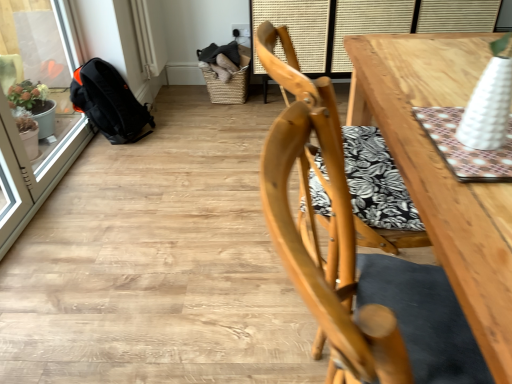
Question: From a real-world perspective, is black fabric backpack at left positioned above or below woven brown basket at upper center?

Choices:
 (A) above
 (B) below

Answer: (A)

Question: Considering the positions of black fabric backpack at left and woven brown basket at upper center in the image, is black fabric backpack at left wider or thinner than woven brown basket at upper center?

Choices:
 (A) wide
 (B) thin

Answer: (B)

Question: Which is farther from the black fabric backpack at left?

Choices:
 (A) transparent glass screen door at left
 (B) woven brown basket at upper center
 (C) light wood chair at center
 (D) wooden table at upper right

Answer: (C)

Question: Estimate the real-world distances between objects in this image. Which object is closer to the transparent glass screen door at left?

Choices:
 (A) black fabric backpack at left
 (B) light wood chair at center
 (C) woven brown basket at upper center
 (D) wooden table at upper right

Answer: (A)